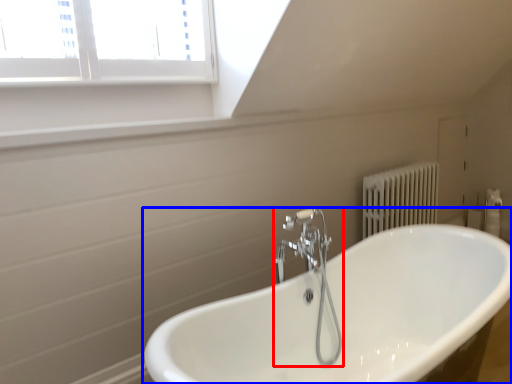
Question: Which of the following is the farthest to the observer, tap (highlighted by a red box) or bathtub (highlighted by a blue box)?

Choices:
 (A) tap
 (B) bathtub

Answer: (A)